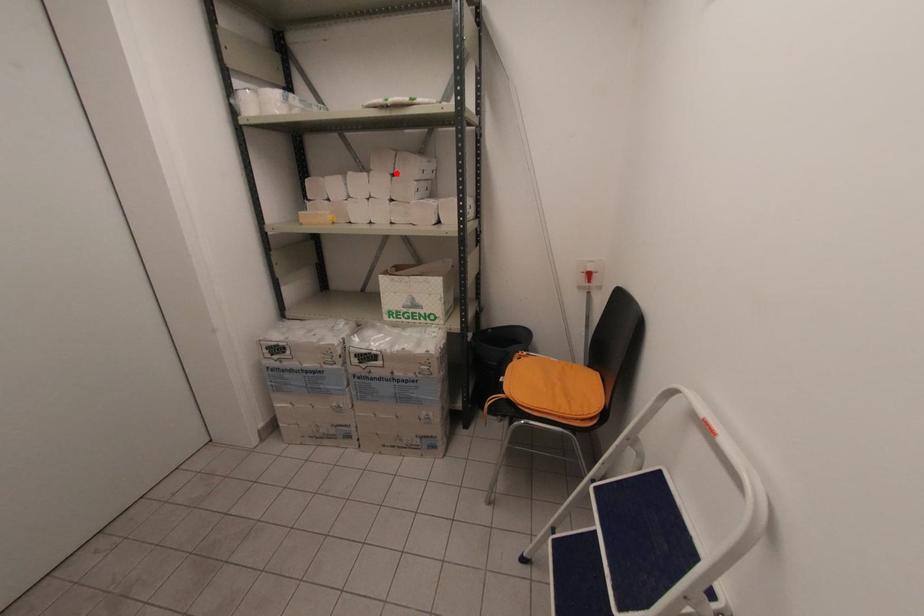
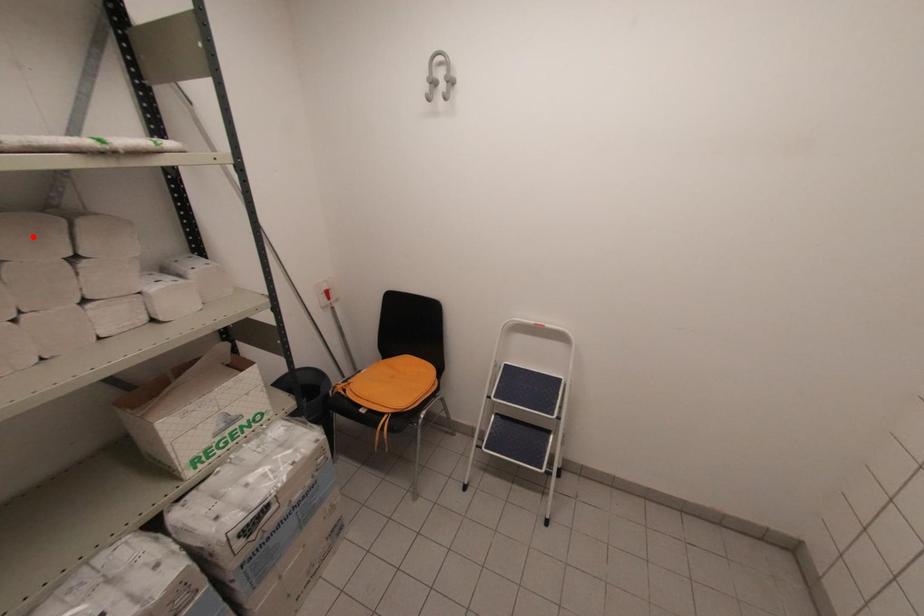
I am providing you with two images of the same scene from different viewpoints. A red point is marked on the first image and another point is marked on the second image. Does the point marked in image1 correspond to the same location as the one in image2?

No